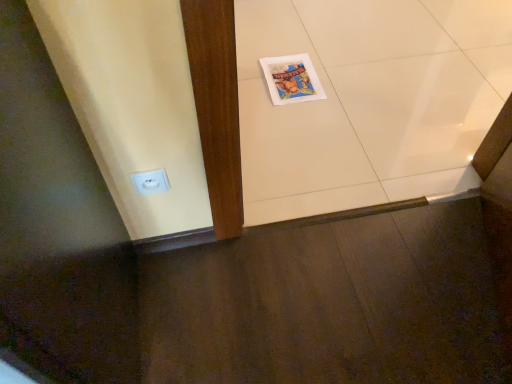
This screenshot has width=512, height=384. Find the location of `free space to the left of matte paper comic book at center`. free space to the left of matte paper comic book at center is located at coordinates (253, 77).